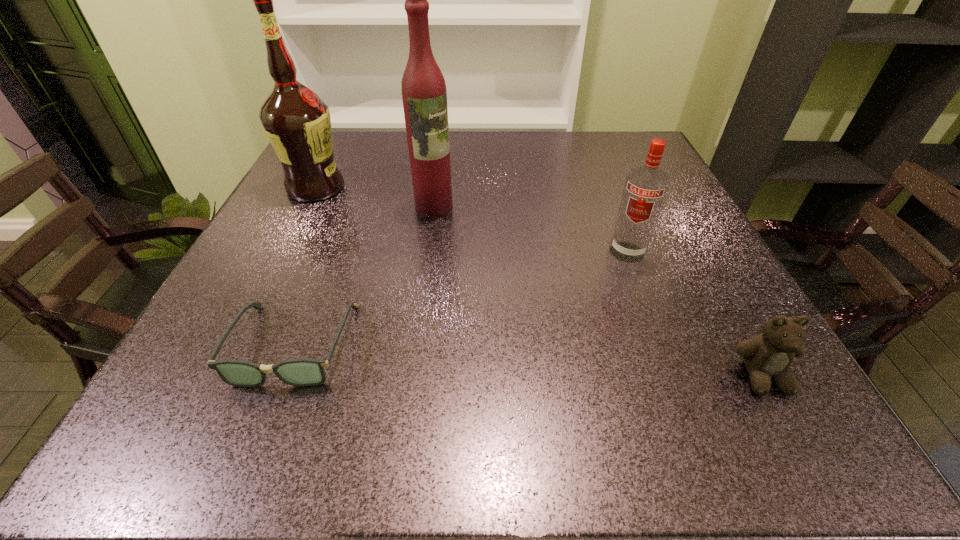
Find the location of `vacant space on the desktop that is between the spectacles and the teddy bear and is positioned on the label of the alcohol`. vacant space on the desktop that is between the spectacles and the teddy bear and is positioned on the label of the alcohol is located at coordinates (558, 362).

Where is `vacant spot on the desktop that is between the spectacles and the rightmost object and is positioned on the front label of the third shortest object`? The height and width of the screenshot is (540, 960). vacant spot on the desktop that is between the spectacles and the rightmost object and is positioned on the front label of the third shortest object is located at coordinates (590, 364).

At what (x,y) coordinates should I click in order to perform the action: click on vacant spot on the desktop that is between the shortest object and the rightmost object and is positioned on the label of the liquor. Please return your answer as a coordinate pair (x, y). The width and height of the screenshot is (960, 540). Looking at the image, I should click on (551, 362).